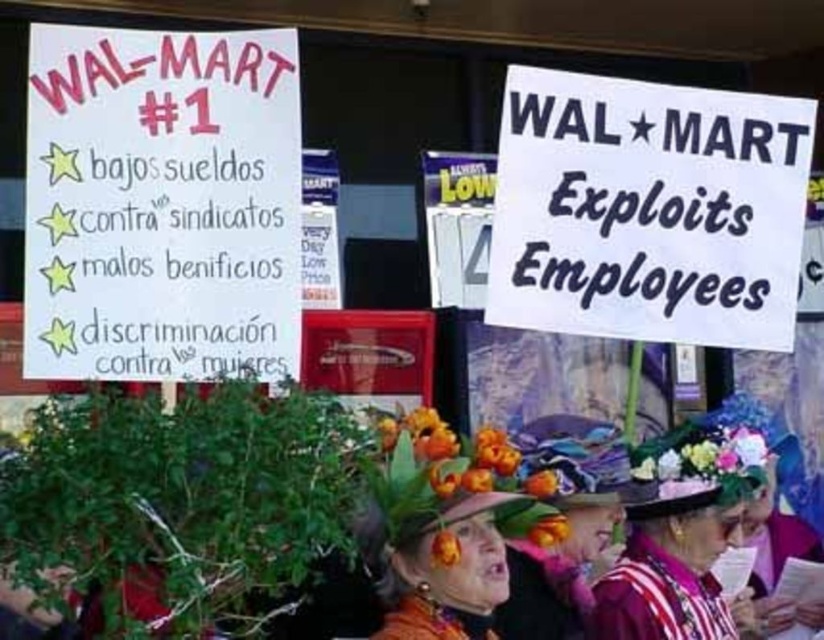
Is floral fabric hat at center to the right of floral hat at center from the viewer's perspective?

Incorrect, floral fabric hat at center is not on the right side of floral hat at center.

Does floral fabric hat at center have a lesser width compared to floral hat at center?

Yes, floral fabric hat at center is thinner than floral hat at center.

Who is more distant from viewer, (x=476, y=435) or (x=696, y=637)?

Positioned behind is point (x=696, y=637).

Identify the location of floral fabric hat at center. The width and height of the screenshot is (824, 640). (445, 528).